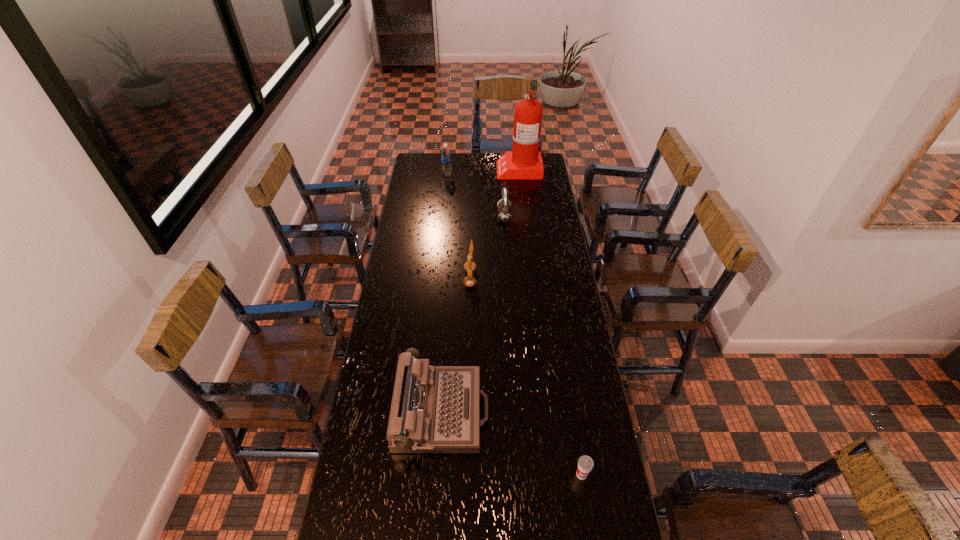
Find the location of a particular element. The image size is (960, 540). water bottle at the far edge is located at coordinates (445, 153).

Identify the location of object that is at the left edge. This screenshot has width=960, height=540. (435, 409).

Locate an element on the screen. fire extinguisher located at the right edge is located at coordinates (524, 161).

Where is `cup that is at the right edge`? The width and height of the screenshot is (960, 540). cup that is at the right edge is located at coordinates (585, 464).

Locate an element on the screen. This screenshot has width=960, height=540. object present at the far right corner is located at coordinates (524, 161).

The height and width of the screenshot is (540, 960). In the image, there is a desktop. What are the coordinates of `vacant space at the left edge` in the screenshot? It's located at (388, 397).

What are the coordinates of `vacant space at the right edge of the desktop` in the screenshot? It's located at (582, 456).

Where is `free space at the far left corner of the desktop`? free space at the far left corner of the desktop is located at coordinates (431, 172).

Find the location of a particular element. Image resolution: width=960 pixels, height=540 pixels. free space between the right earphone and the water bottle is located at coordinates (476, 195).

At what (x,y) coordinates should I click in order to perform the action: click on free point between the third farthest object and the water bottle. Please return your answer as a coordinate pair (x, y). This screenshot has height=540, width=960. Looking at the image, I should click on (476, 195).